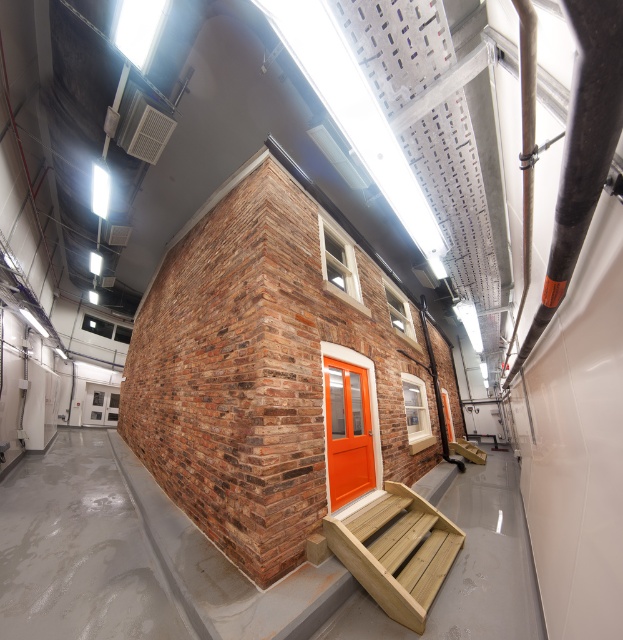
You are a delivery person with a cart that is 2 meters wide. You need to move from the brown brick at center to the orange glossy door at center. Is there enough space between them for your cart to pass through?

The distance between the brown brick at center and the orange glossy door at center is 3.47 meters. Since your cart is 2 meters wide, there is sufficient space for it to pass through.

You are standing in the industrial setting shown in the image. There is a point at coordinates point (278, 372). What is located at that point?

The point (278, 372) indicates brown brick at center.